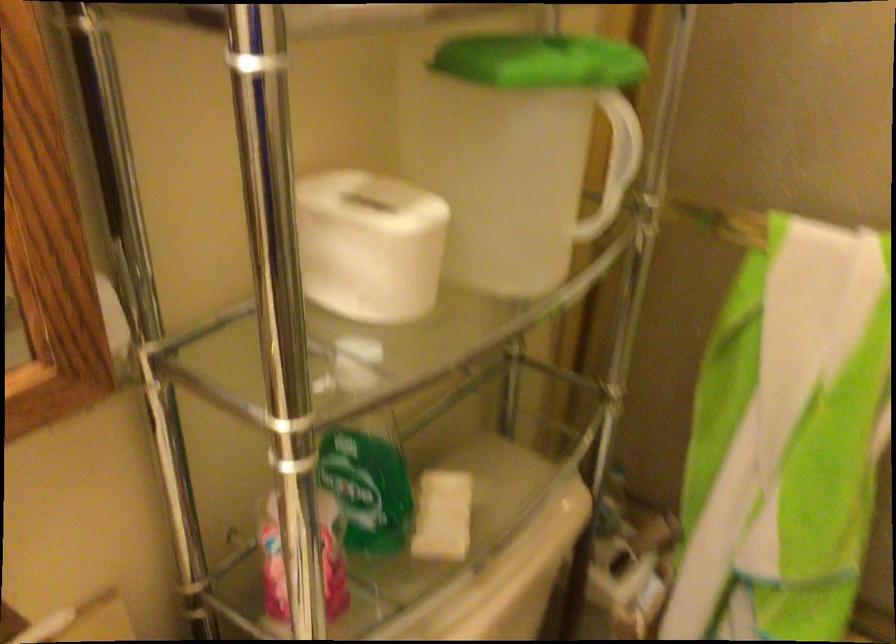
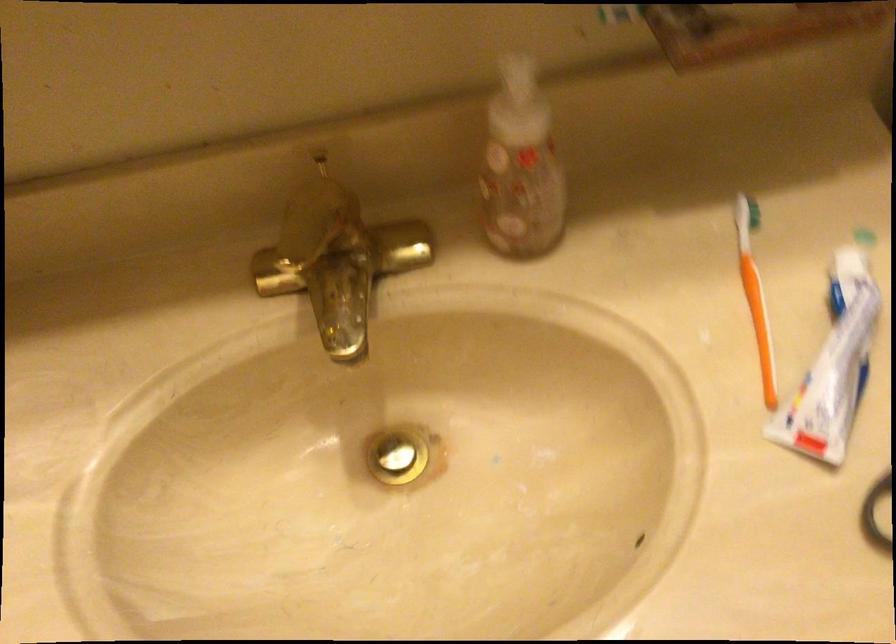
How did the camera likely rotate?

The camera's rotation is toward left-down.